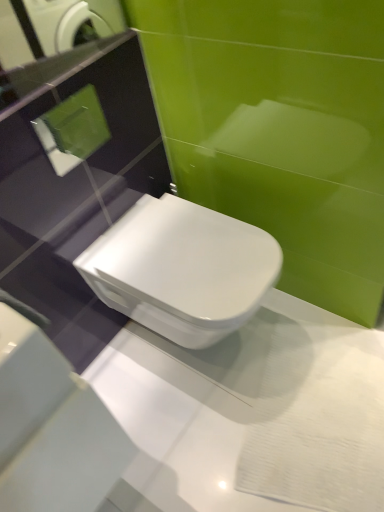
Find the location of a particular element. Image resolution: width=384 pixels, height=512 pixels. free point above white glossy toilet at center (from a real-world perspective) is located at coordinates (190, 248).